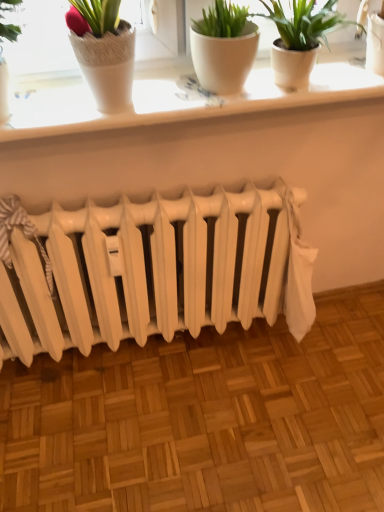
The height and width of the screenshot is (512, 384). I want to click on vacant space to the left of white matte flowerpot at upper center, so click(x=171, y=95).